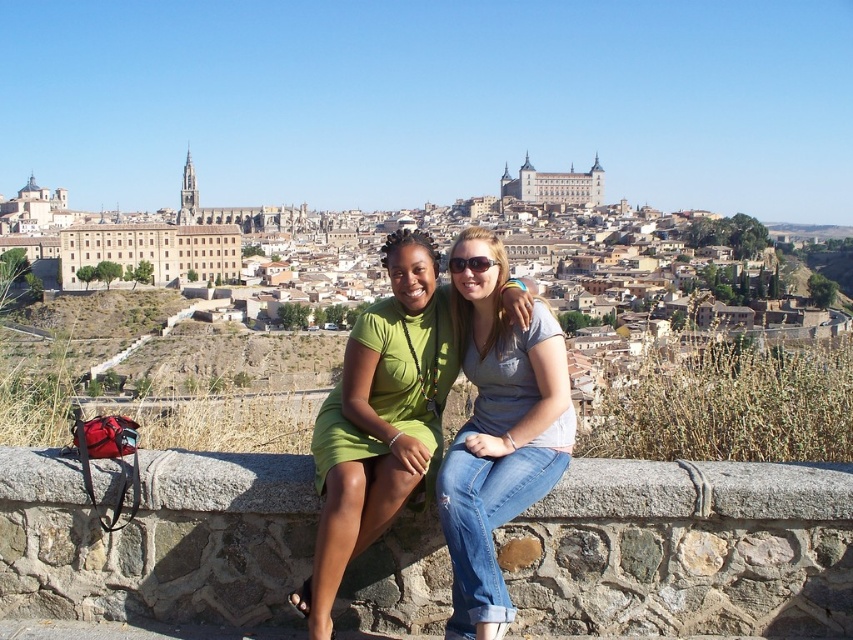
Which is below, green matte dress at center or denim jeans at center?

denim jeans at center is below.

Which is behind, point (428, 388) or point (518, 355)?

Point (428, 388)

Between point (354, 486) and point (469, 326), which one is positioned in front?

Point (354, 486)

Image resolution: width=853 pixels, height=640 pixels. I want to click on green matte dress at center, so click(x=379, y=419).

How much distance is there between stone ledge at center and green matte dress at center?

They are 38.29 feet apart.

Can you confirm if stone ledge at center is positioned below green matte dress at center?

Yes, stone ledge at center is below green matte dress at center.

The height and width of the screenshot is (640, 853). Describe the element at coordinates (683, 550) in the screenshot. I see `stone ledge at center` at that location.

Find the location of `stone ledge at center`. stone ledge at center is located at coordinates (683, 550).

Is point (259, 547) less distant than point (465, 522)?

No, (259, 547) is further to viewer.

Does stone ledge at center have a greater height compared to denim jeans at center?

Incorrect, stone ledge at center's height is not larger of denim jeans at center's.

The width and height of the screenshot is (853, 640). I want to click on stone ledge at center, so click(683, 550).